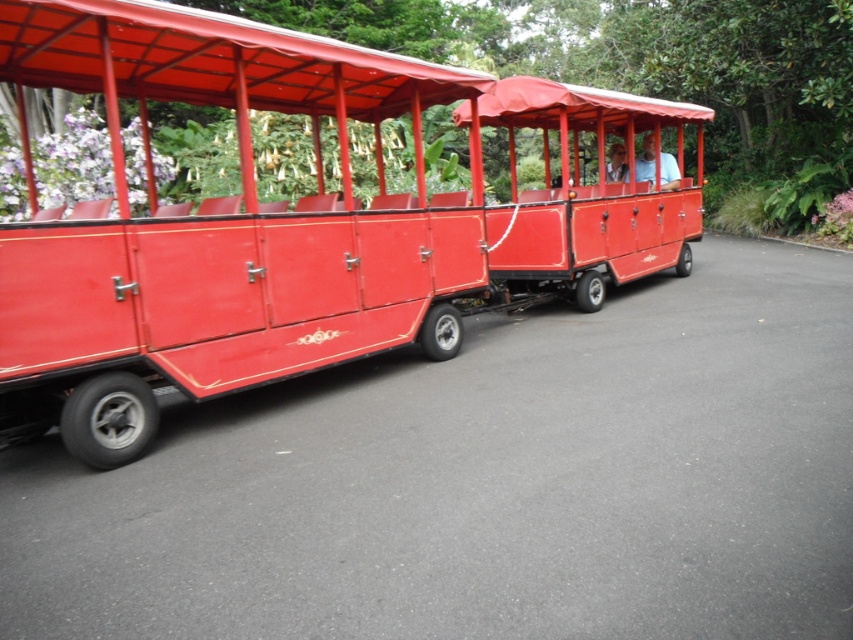
In the scene shown: You are a passenger on a sightseeing tour and want to take a photo of the matte red train car at center and the matte red coach at center from the front. Which one should you stand in front of to capture both in the frame?

You should stand in front of the matte red train car at center because the matte red coach at center is behind it, so positioning yourself in front of the train car will allow both vehicles to be visible in the photo.

You are a passenger on a sightseeing tour and see the matte red train car at center and the matte red coach at center. Which one is more to the left?

The matte red train car at center is positioned on the left side of matte red coach at center, so it is more to the left.